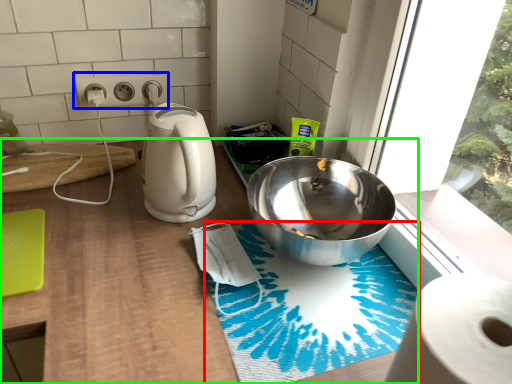
Question: Estimate the real-world distances between objects in this image. Which object is closer to bath mat (highlighted by a red box), electric outlet (highlighted by a blue box) or counter (highlighted by a green box)?

Choices:
 (A) electric outlet
 (B) counter

Answer: (B)